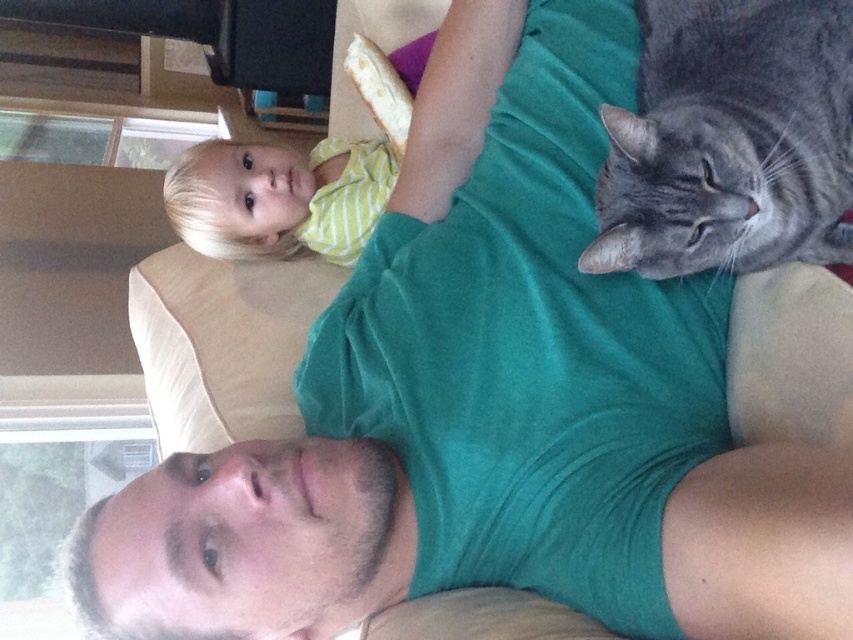
Question: Is gray tabby cat at upper right thinner than yellow striped shirt at upper left?

Choices:
 (A) no
 (B) yes

Answer: (B)

Question: Does gray tabby cat at upper right have a greater width compared to yellow striped shirt at upper left?

Choices:
 (A) yes
 (B) no

Answer: (B)

Question: Which object is farther from the camera taking this photo?

Choices:
 (A) yellow striped shirt at upper left
 (B) gray tabby cat at upper right

Answer: (A)

Question: Which of the following is the farthest from the observer?

Choices:
 (A) (274, 156)
 (B) (682, 42)

Answer: (A)

Question: Is gray tabby cat at upper right bigger than yellow striped shirt at upper left?

Choices:
 (A) no
 (B) yes

Answer: (A)